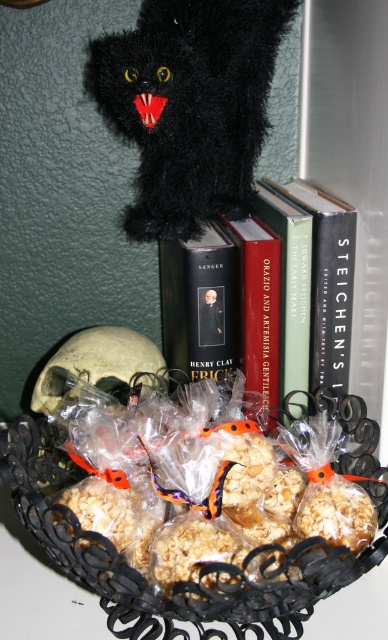
Looking at this image, you are organizing a shelf and see the black plastic basket at lower center and the hardcover book at center. Which object is nearer to you?

The black plastic basket at lower center is closer to the viewer than the hardcover book at center.

You are holding a small toy mouse that is 2 inches long. You want to place it in the black plastic basket at lower center. Can you estimate if the basket is far enough away from you to reach it comfortably?

The black plastic basket at lower center is 16.63 inches away from the camera, so yes, the basket is far enough to comfortably place the toy mouse since it is only 2 inches long.

Looking at this image, you are organizing a shelf and see the fuzzy black cat at upper center and the hardcover book at center. Which item is positioned higher on the shelf?

The fuzzy black cat at upper center is positioned higher than the hardcover book at center.